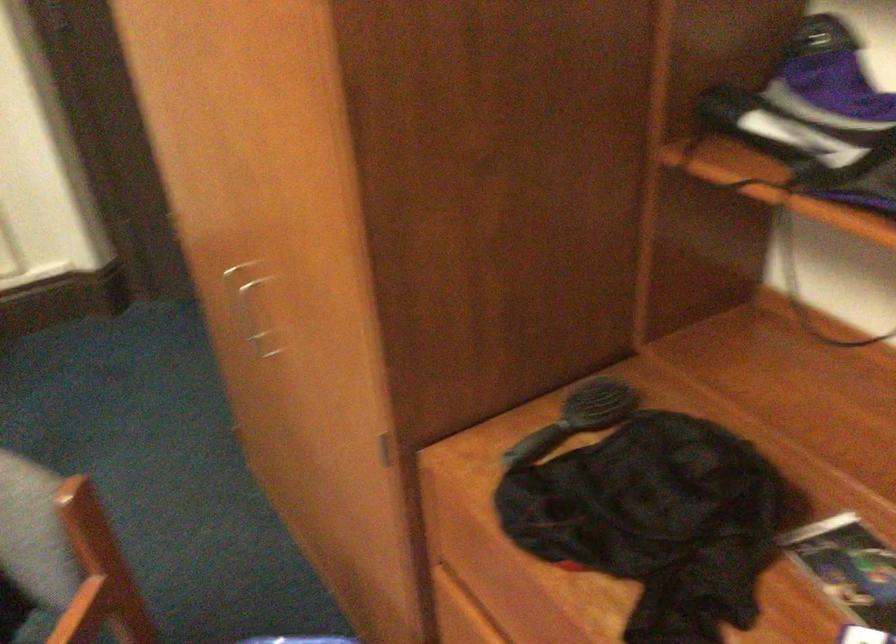
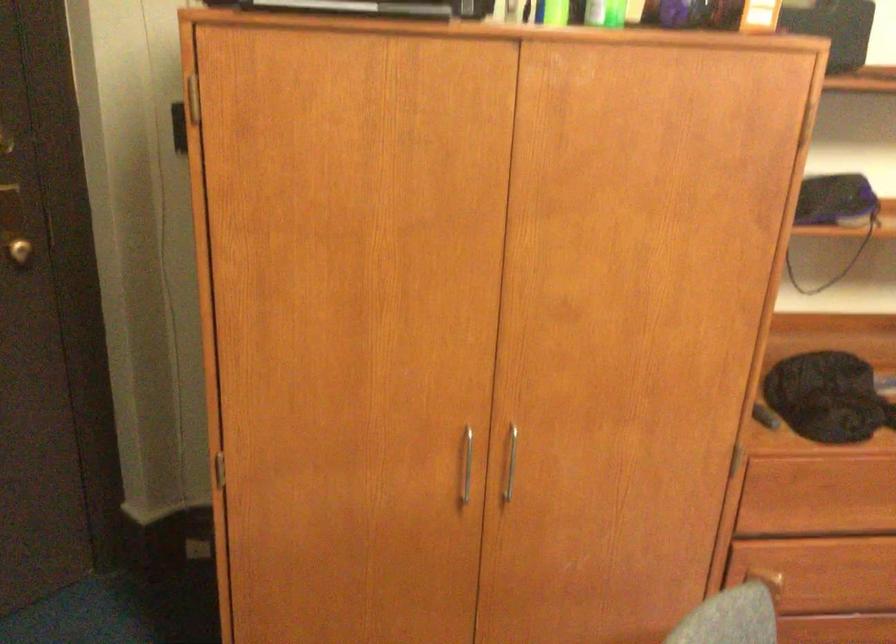
The point at (x=279, y=333) is marked in the first image. Where is the corresponding point in the second image?

(511, 462)